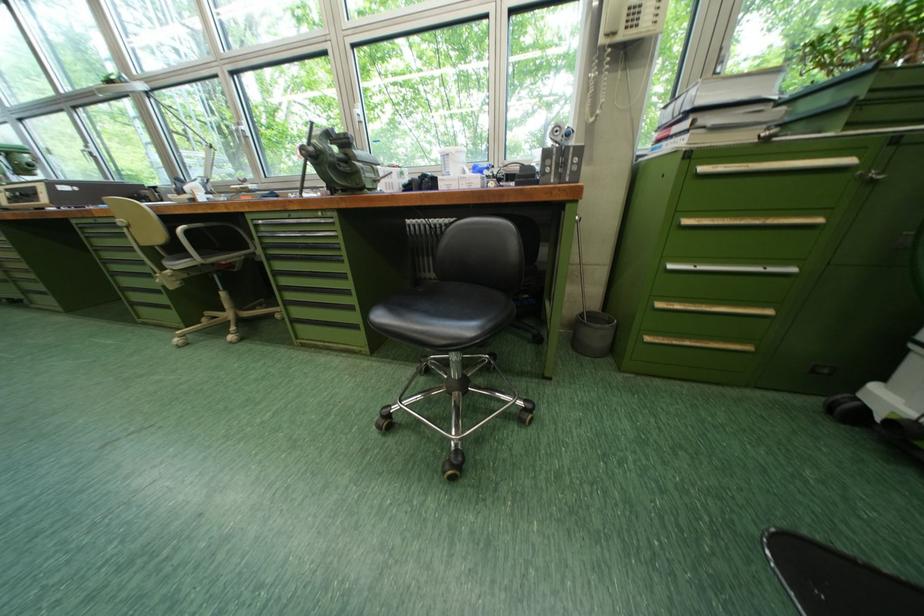
Where would you sit the black chair sitting surface? Please return your answer as a coordinate pair (x, y).

(447, 302)